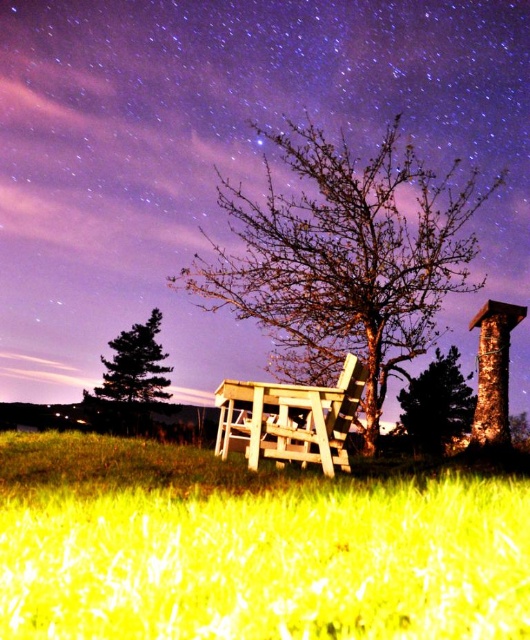
Question: Is green grass at lower center positioned before smooth wooden tree at center?

Choices:
 (A) yes
 (B) no

Answer: (A)

Question: Among these objects, which one is nearest to the camera?

Choices:
 (A) wooden table at center
 (B) green textured tree at center

Answer: (A)

Question: In this image, where is green grass at lower center located relative to green textured tree at center?

Choices:
 (A) left
 (B) right

Answer: (A)

Question: Which point is farther from the camera taking this photo?

Choices:
 (A) tap(297, 426)
 (B) tap(163, 403)

Answer: (B)

Question: Which point is farther to the camera?

Choices:
 (A) (403, 403)
 (B) (501, 134)
 (C) (130, 417)

Answer: (C)

Question: In this image, where is smooth wooden tree at center located relative to green matte tree at lower left?

Choices:
 (A) above
 (B) below

Answer: (A)